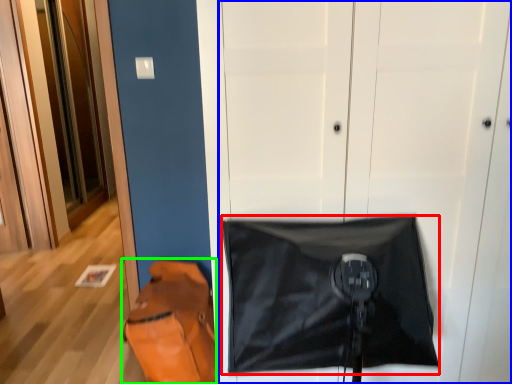
Question: Which object is positioned farthest from blanket (highlighted by a red box)? Select from door (highlighted by a blue box) and messenger bag (highlighted by a green box).

Choices:
 (A) door
 (B) messenger bag

Answer: (B)